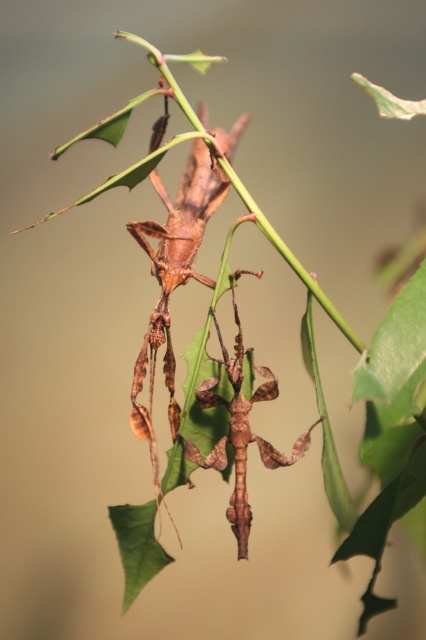
Question: Is brown matte stick insect at center above brown leaf-like at center?

Choices:
 (A) yes
 (B) no

Answer: (A)

Question: Among these points, which one is nearest to the camera?

Choices:
 (A) (301, 442)
 (B) (172, 273)

Answer: (A)

Question: Is brown matte stick insect at center to the left of brown leaf-like at center from the viewer's perspective?

Choices:
 (A) no
 (B) yes

Answer: (B)

Question: Which point is farther to the camera?

Choices:
 (A) (x=204, y=387)
 (B) (x=196, y=218)

Answer: (A)

Question: Which point is farther from the camera taking this photo?

Choices:
 (A) (166, 200)
 (B) (195, 460)

Answer: (A)

Question: Is brown matte stick insect at center below brown leaf-like at center?

Choices:
 (A) yes
 (B) no

Answer: (B)